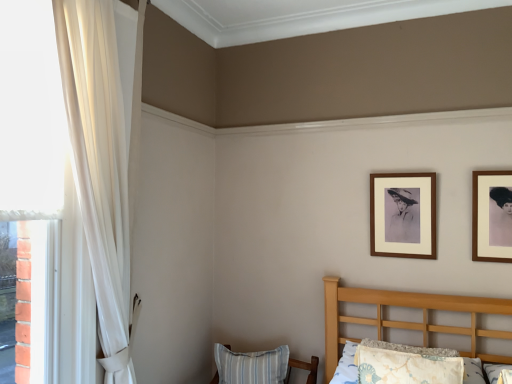
Question: Is sheer white curtain at left smaller than wooden picture frame at upper right, positioned as the 1th picture frame in right-to-left order?

Choices:
 (A) yes
 (B) no

Answer: (B)

Question: Can you see sheer white curtain at left touching wooden picture frame at upper right, positioned as the 1th picture frame in right-to-left order?

Choices:
 (A) yes
 (B) no

Answer: (B)

Question: Does sheer white curtain at left turn towards wooden picture frame at upper right, positioned as the second picture frame in left-to-right order?

Choices:
 (A) yes
 (B) no

Answer: (B)

Question: Is sheer white curtain at left at the left side of wooden picture frame at upper right, positioned as the second picture frame in left-to-right order?

Choices:
 (A) yes
 (B) no

Answer: (A)

Question: From a real-world perspective, is sheer white curtain at left beneath wooden picture frame at upper right, the 1th picture frame in the front-to-back sequence?

Choices:
 (A) yes
 (B) no

Answer: (B)

Question: Is sheer white curtain at left far from wooden picture frame at upper right, positioned as the second picture frame in left-to-right order?

Choices:
 (A) no
 (B) yes

Answer: (B)

Question: Can you confirm if blue striped pillow at lower center, which is counted as the second pillow, starting from the top, is wider than wooden picture frame at upper right, positioned as the second picture frame in left-to-right order?

Choices:
 (A) no
 (B) yes

Answer: (B)

Question: Are blue striped pillow at lower center, the first pillow positioned from the bottom, and wooden picture frame at upper right, positioned as the 1th picture frame in right-to-left order, far apart?

Choices:
 (A) no
 (B) yes

Answer: (B)

Question: Is blue striped pillow at lower center, which appears as the second pillow when viewed from the right, located outside wooden picture frame at upper right, which is the second picture frame in back-to-front order?

Choices:
 (A) no
 (B) yes

Answer: (B)

Question: Does blue striped pillow at lower center, the 1th pillow when ordered from left to right, have a smaller size compared to wooden picture frame at upper right, the 1th picture frame in the front-to-back sequence?

Choices:
 (A) no
 (B) yes

Answer: (A)

Question: Does blue striped pillow at lower center, which appears as the 1th pillow when viewed from the back, have a lesser width compared to wooden picture frame at upper right, positioned as the 1th picture frame in right-to-left order?

Choices:
 (A) no
 (B) yes

Answer: (A)

Question: From a real-world perspective, is blue striped pillow at lower center, the first pillow positioned from the bottom, positioned over wooden picture frame at upper right, which is the second picture frame in back-to-front order, based on gravity?

Choices:
 (A) no
 (B) yes

Answer: (A)

Question: From the image's perspective, would you say brown wooden picture frame at upper right, which is the 2th picture frame in front-to-back order, is shown under wooden picture frame at upper right, positioned as the 1th picture frame in right-to-left order?

Choices:
 (A) no
 (B) yes

Answer: (B)